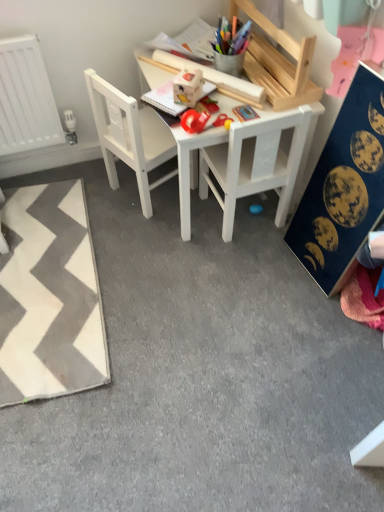
Where is `free space between white matte chair at center, the second chair from the right, and white wooden table at center`? free space between white matte chair at center, the second chair from the right, and white wooden table at center is located at coordinates (154, 216).